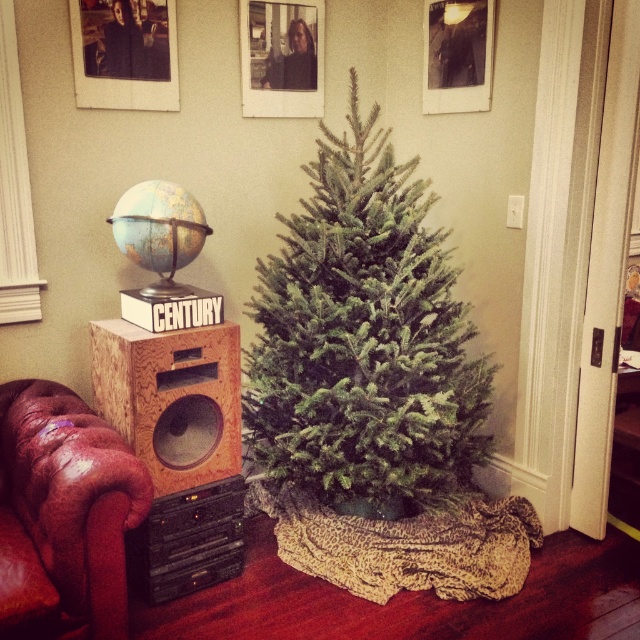
Question: Among these objects, which one is farthest from the camera?

Choices:
 (A) leather at left
 (B) wooden speaker at left
 (C) green natural fir tree at center

Answer: (C)

Question: Which of the following is the closest to the observer?

Choices:
 (A) wooden speaker at left
 (B) leather at left

Answer: (B)

Question: Where is green natural fir tree at center located in relation to wooden speaker at left in the image?

Choices:
 (A) right
 (B) left

Answer: (A)

Question: Can you confirm if leather at left is positioned below wooden speaker at left?

Choices:
 (A) yes
 (B) no

Answer: (A)

Question: Which object is closer to the camera taking this photo?

Choices:
 (A) leather at left
 (B) wooden speaker at left

Answer: (A)

Question: Does green natural fir tree at center appear on the right side of wooden speaker at left?

Choices:
 (A) yes
 (B) no

Answer: (A)